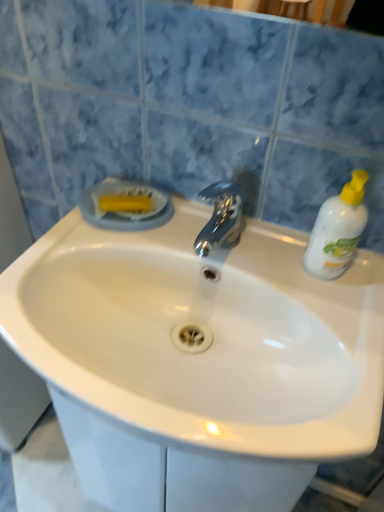
Question: Is white plastic bottle at right aimed at white glossy sink at center?

Choices:
 (A) no
 (B) yes

Answer: (A)

Question: Is white plastic bottle at right outside white glossy sink at center?

Choices:
 (A) no
 (B) yes

Answer: (B)

Question: From a real-world perspective, does white plastic bottle at right stand above white glossy sink at center?

Choices:
 (A) no
 (B) yes

Answer: (B)

Question: Is white plastic bottle at right to the right of white glossy sink at center from the viewer's perspective?

Choices:
 (A) no
 (B) yes

Answer: (B)

Question: Is white plastic bottle at right facing away from white glossy sink at center?

Choices:
 (A) yes
 (B) no

Answer: (B)

Question: From the image's perspective, is white plastic bottle at right above white glossy sink at center?

Choices:
 (A) no
 (B) yes

Answer: (B)

Question: From the image's perspective, is white glossy sink at center beneath white plastic bottle at right?

Choices:
 (A) no
 (B) yes

Answer: (B)

Question: Is white glossy sink at center facing away from white plastic bottle at right?

Choices:
 (A) yes
 (B) no

Answer: (B)

Question: Is white glossy sink at center not near white plastic bottle at right?

Choices:
 (A) no
 (B) yes

Answer: (A)

Question: From a real-world perspective, does white glossy sink at center sit lower than white plastic bottle at right?

Choices:
 (A) no
 (B) yes

Answer: (B)

Question: Is white glossy sink at center shorter than white plastic bottle at right?

Choices:
 (A) no
 (B) yes

Answer: (B)

Question: Is white glossy sink at center surrounding white plastic bottle at right?

Choices:
 (A) no
 (B) yes

Answer: (A)

Question: In terms of size, does white plastic bottle at right appear bigger or smaller than white glossy sink at center?

Choices:
 (A) small
 (B) big

Answer: (A)